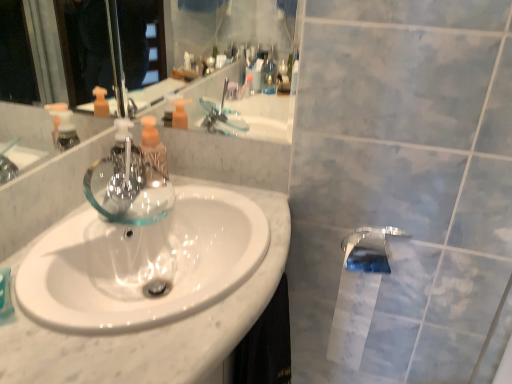
Question: Is translucent plastic soap dispenser at center further to the viewer compared to white paper at lower right?

Choices:
 (A) yes
 (B) no

Answer: (B)

Question: Considering the relative sizes of translucent plastic soap dispenser at center and white paper at lower right in the image provided, is translucent plastic soap dispenser at center thinner than white paper at lower right?

Choices:
 (A) yes
 (B) no

Answer: (A)

Question: Would you consider translucent plastic soap dispenser at center to be distant from white paper at lower right?

Choices:
 (A) yes
 (B) no

Answer: (B)

Question: Is translucent plastic soap dispenser at center surrounding white paper at lower right?

Choices:
 (A) no
 (B) yes

Answer: (A)

Question: From the image's perspective, is translucent plastic soap dispenser at center below white paper at lower right?

Choices:
 (A) no
 (B) yes

Answer: (A)

Question: Considering the positions of translucent plastic soap dispenser at center and white glossy sink at center in the image, is translucent plastic soap dispenser at center bigger or smaller than white glossy sink at center?

Choices:
 (A) small
 (B) big

Answer: (A)

Question: Relative to white glossy sink at center, is translucent plastic soap dispenser at center in front or behind?

Choices:
 (A) front
 (B) behind

Answer: (B)

Question: From a real-world perspective, is translucent plastic soap dispenser at center positioned above or below white glossy sink at center?

Choices:
 (A) below
 (B) above

Answer: (B)

Question: Would you say translucent plastic soap dispenser at center is to the left or to the right of white glossy sink at center in the picture?

Choices:
 (A) right
 (B) left

Answer: (B)

Question: In terms of width, does polished chrome tap at lower right, the first tap viewed from the right, look wider or thinner when compared to white glossy sink at center?

Choices:
 (A) thin
 (B) wide

Answer: (A)

Question: From a real-world perspective, is polished chrome tap at lower right, the first tap when ordered from bottom to top, physically located above or below white glossy sink at center?

Choices:
 (A) below
 (B) above

Answer: (A)

Question: Considering the positions of polished chrome tap at lower right, acting as the second tap starting from the left, and white glossy sink at center in the image, is polished chrome tap at lower right, acting as the second tap starting from the left, taller or shorter than white glossy sink at center?

Choices:
 (A) tall
 (B) short

Answer: (B)

Question: Considering their positions, is polished chrome tap at lower right, positioned as the second tap in top-to-bottom order, located in front of or behind white glossy sink at center?

Choices:
 (A) front
 (B) behind

Answer: (B)

Question: Is point (125, 185) closer or farther from the camera than point (338, 297)?

Choices:
 (A) closer
 (B) farther

Answer: (A)

Question: Which is correct: transparent glass tap at center, positioned as the second tap in bottom-to-top order, is inside white paper at lower right, or outside of it?

Choices:
 (A) inside
 (B) outside

Answer: (B)